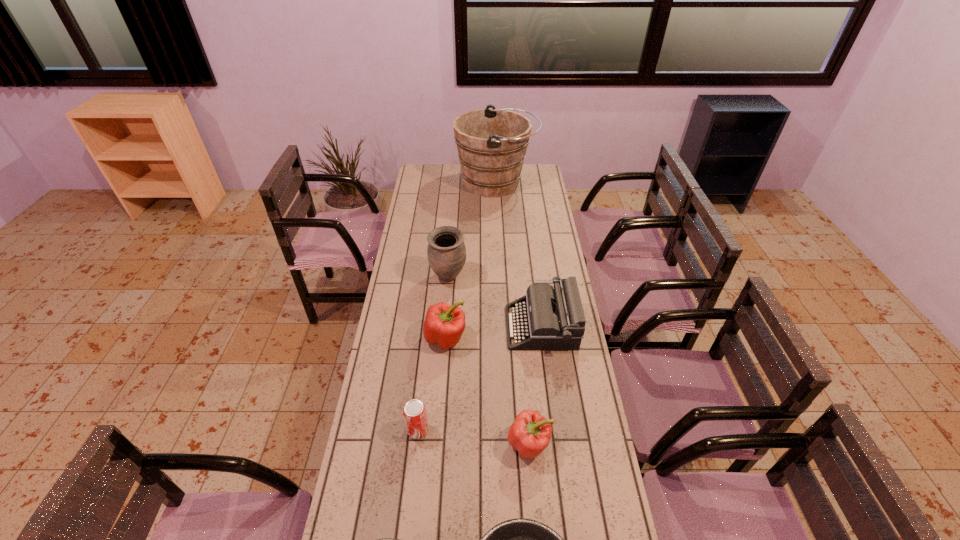
Identify the location of bucket that is at the right edge. (491, 143).

Where is `typewriter that is at the right edge`? typewriter that is at the right edge is located at coordinates (545, 319).

Where is `bell pepper at the right edge`? This screenshot has height=540, width=960. bell pepper at the right edge is located at coordinates (530, 433).

The image size is (960, 540). What are the coordinates of `object at the far right corner` in the screenshot? It's located at (491, 143).

Where is `free spot at the left edge of the desktop`? free spot at the left edge of the desktop is located at coordinates (429, 204).

In order to click on vacant area at the right edge in this screenshot , I will do `click(543, 216)`.

Locate an element on the screen. Image resolution: width=960 pixels, height=540 pixels. free spot at the far right corner of the desktop is located at coordinates (536, 173).

The width and height of the screenshot is (960, 540). In order to click on vacant area that lies between the right bell pepper and the typewriter in this screenshot , I will do `click(536, 386)`.

Where is `unoccupied position between the farthest object and the urn`? The image size is (960, 540). unoccupied position between the farthest object and the urn is located at coordinates (472, 231).

Identify the location of vacant area that lies between the typewriter and the sixth nearest object. (494, 302).